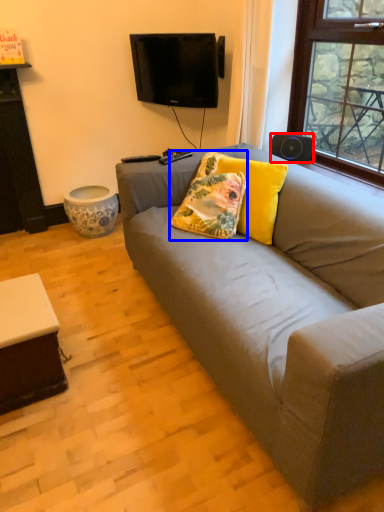
Question: Which of the following is the farthest to the observer, loudspeaker (highlighted by a red box) or pillow (highlighted by a blue box)?

Choices:
 (A) loudspeaker
 (B) pillow

Answer: (A)